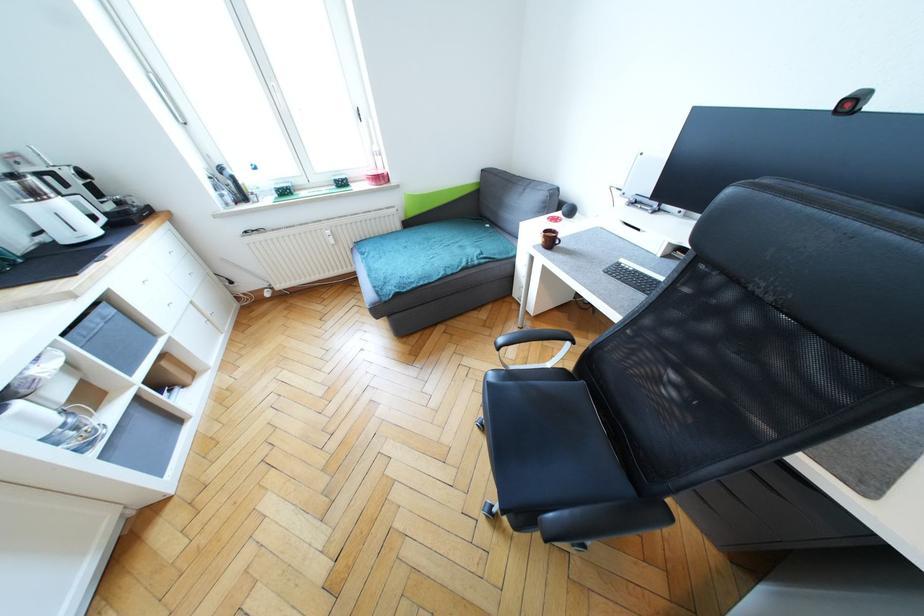
Find the location of `black chair armrest`. black chair armrest is located at coordinates (532, 337).